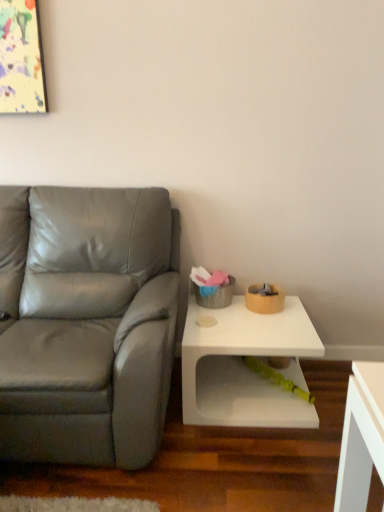
Question: Can you confirm if white matte table at lower right is thinner than rubberized green toy at lower center?

Choices:
 (A) no
 (B) yes

Answer: (A)

Question: Is the position of white matte table at lower right more distant than that of rubberized green toy at lower center?

Choices:
 (A) no
 (B) yes

Answer: (A)

Question: From the image's perspective, is white matte table at lower right above rubberized green toy at lower center?

Choices:
 (A) yes
 (B) no

Answer: (A)

Question: Is white matte table at lower right oriented away from rubberized green toy at lower center?

Choices:
 (A) no
 (B) yes

Answer: (A)

Question: Is white matte table at lower right bigger than rubberized green toy at lower center?

Choices:
 (A) yes
 (B) no

Answer: (A)

Question: From the image's perspective, is rubberized green toy at lower center located above or below white matte table at lower right?

Choices:
 (A) below
 (B) above

Answer: (A)

Question: From a real-world perspective, is rubberized green toy at lower center physically located above or below white matte table at lower right?

Choices:
 (A) above
 (B) below

Answer: (B)

Question: Does point (297, 386) appear closer or farther from the camera than point (258, 332)?

Choices:
 (A) closer
 (B) farther

Answer: (B)

Question: Looking at the image, does rubberized green toy at lower center seem bigger or smaller compared to white matte table at lower right?

Choices:
 (A) big
 (B) small

Answer: (B)

Question: Looking at their shapes, would you say rubberized green toy at lower center is wider or thinner than matte gray leather couch at left?

Choices:
 (A) thin
 (B) wide

Answer: (A)

Question: Visually, is rubberized green toy at lower center positioned to the left or to the right of matte gray leather couch at left?

Choices:
 (A) left
 (B) right

Answer: (B)

Question: From the image's perspective, relative to matte gray leather couch at left, is rubberized green toy at lower center above or below?

Choices:
 (A) below
 (B) above

Answer: (A)

Question: Which is correct: rubberized green toy at lower center is inside matte gray leather couch at left, or outside of it?

Choices:
 (A) inside
 (B) outside

Answer: (B)

Question: In terms of height, does matte gray leather couch at left look taller or shorter compared to white matte table at lower right?

Choices:
 (A) short
 (B) tall

Answer: (B)

Question: From a real-world perspective, is matte gray leather couch at left positioned above or below white matte table at lower right?

Choices:
 (A) above
 (B) below

Answer: (A)